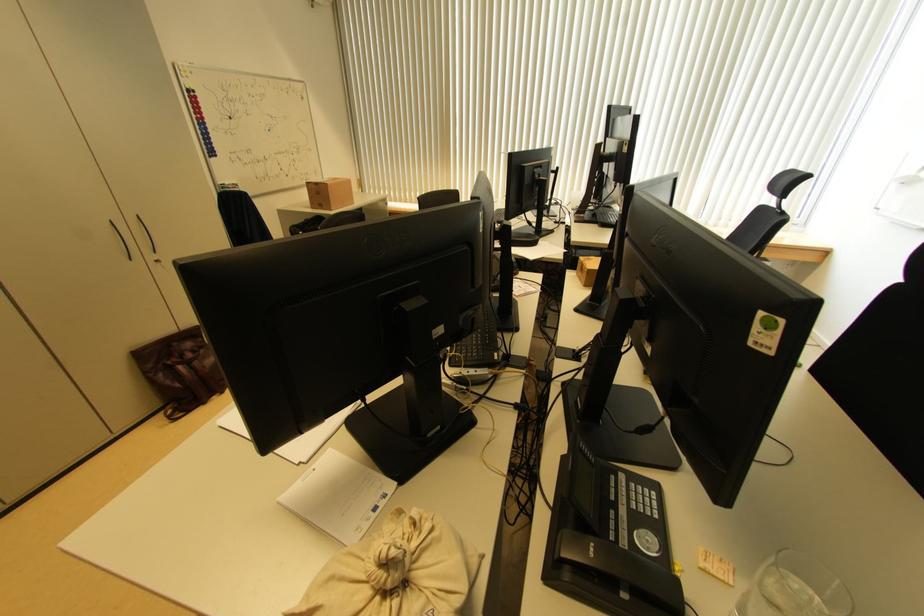
Which object does [395,572] point to?

This point indicates the beige cloth bag.